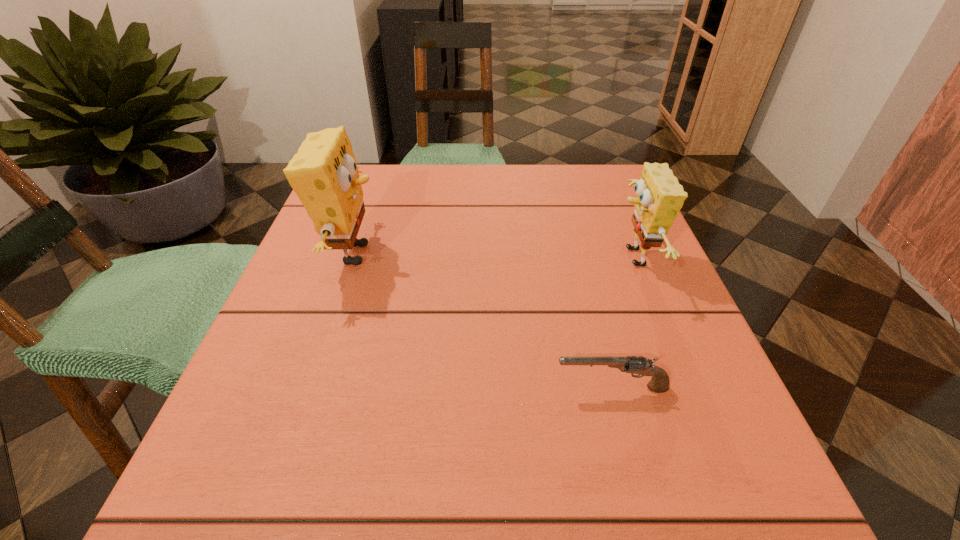
Where is `vacant region located aiming along the barrel of the shortest object`? vacant region located aiming along the barrel of the shortest object is located at coordinates (383, 388).

This screenshot has height=540, width=960. In order to click on free space located 0.110m aiming along the barrel of the shortest object in this screenshot , I will do `click(479, 388)`.

Locate an element on the screen. This screenshot has width=960, height=540. blank area located aiming along the barrel of the shortest object is located at coordinates (520, 388).

At what (x,y) coordinates should I click in order to perform the action: click on object positioned at the far edge. Please return your answer as a coordinate pair (x, y). This screenshot has width=960, height=540. Looking at the image, I should click on (324, 174).

I want to click on object that is at the left edge, so click(x=324, y=174).

The height and width of the screenshot is (540, 960). What are the coordinates of `sponge situated at the right edge` in the screenshot? It's located at point(659,198).

At what (x,y) coordinates should I click in order to perform the action: click on gun present at the right edge. Please return your answer as a coordinate pair (x, y). Looking at the image, I should click on (659, 383).

Locate an element on the screen. This screenshot has height=540, width=960. object situated at the far left corner is located at coordinates (324, 174).

You are a GUI agent. You are given a task and a screenshot of the screen. Output one action in this format:
    pyautogui.click(x=<x>, y=<y>)
    Task: Click on the vacant space at the far edge
    This screenshot has width=960, height=540.
    Given the screenshot: What is the action you would take?
    (543, 191)

Identify the location of free region at the near edge of the desktop. (326, 519).